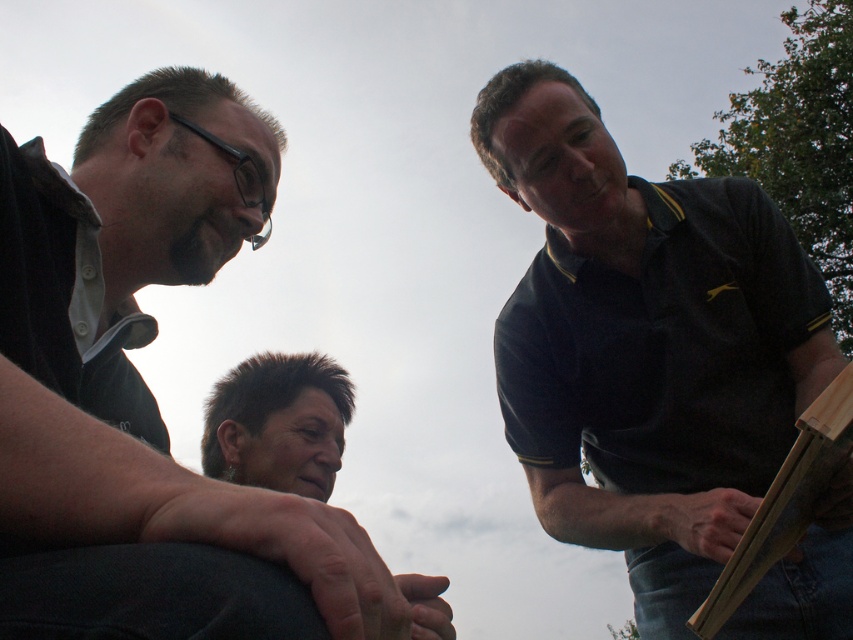
Question: Can you confirm if black jersey at upper right is wider than wooden frame at right?

Choices:
 (A) yes
 (B) no

Answer: (A)

Question: Estimate the real-world distances between objects in this image. Which object is closer to the black jersey at upper right?

Choices:
 (A) wooden frame at right
 (B) matte black shirt at left

Answer: (A)

Question: Which point appears closest to the camera in this image?

Choices:
 (A) (850, 552)
 (B) (126, 486)
 (C) (746, 548)

Answer: (B)

Question: In this image, where is black jersey at upper right located relative to wooden frame at right?

Choices:
 (A) above
 (B) below

Answer: (A)

Question: Which object is positioned closest to the black jersey at upper right?

Choices:
 (A) wooden frame at right
 (B) matte black shirt at left

Answer: (A)

Question: Is matte black shirt at left behind wooden frame at right?

Choices:
 (A) no
 (B) yes

Answer: (A)